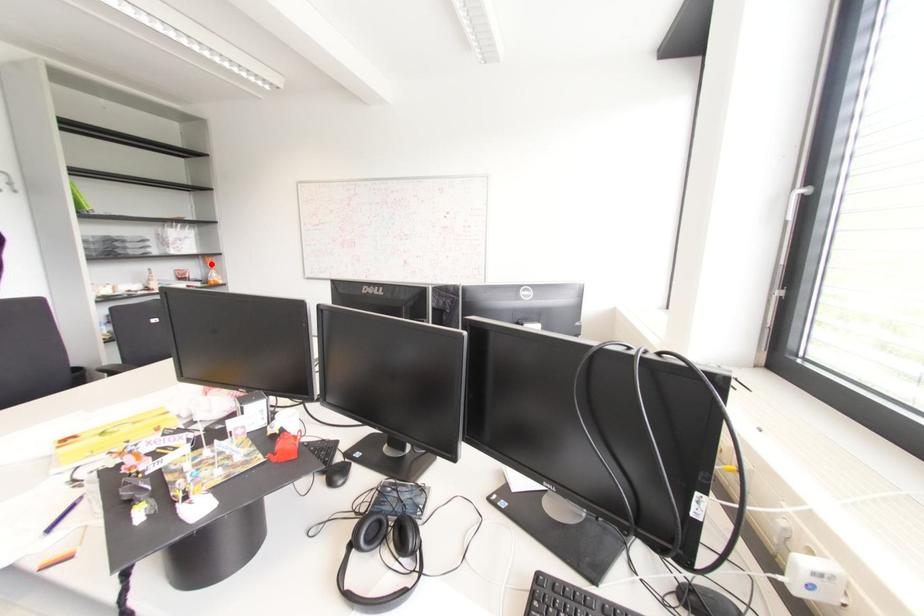
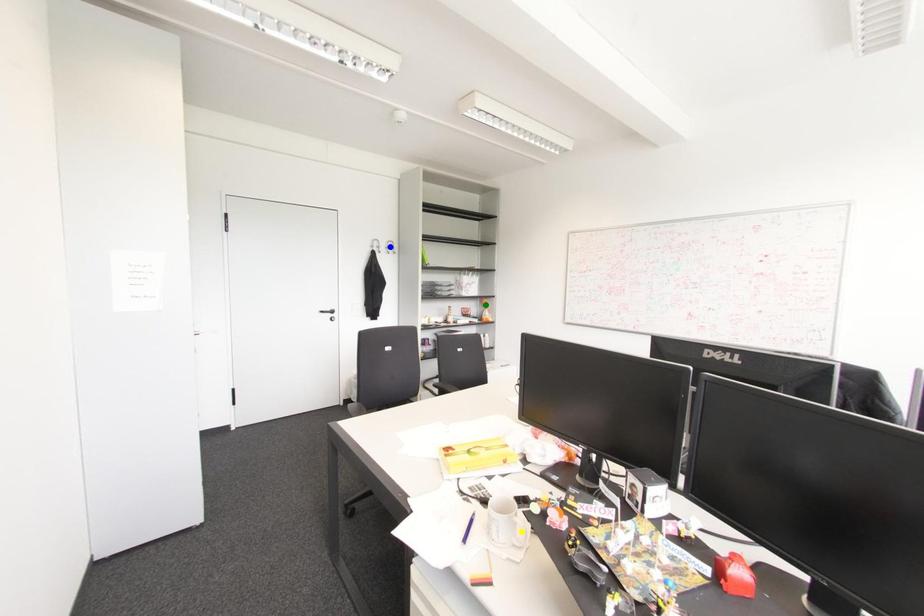
Question: I am providing you with two images of the same scene from different viewpoints. A red point is marked on the first image. You are given multiple points on the second image. In image 2, which mark is for the same physical point as the one in image 1?

Choices:
 (A) yellow point
 (B) blue point
 (C) green point

Answer: (C)